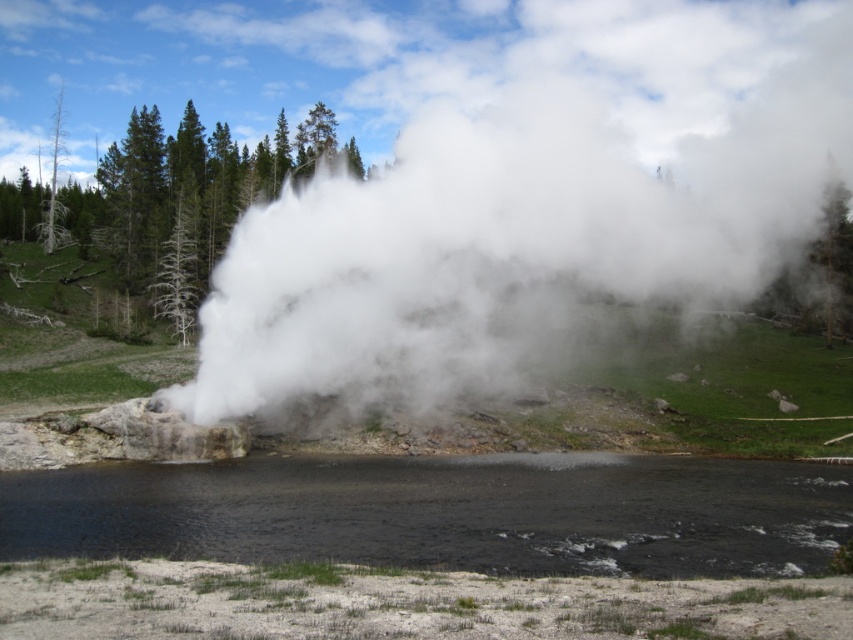
You are a hiker standing at the edge of the river and want to cross it. You notice the white vapor at center and the black liquid at center. Which object is closer to you, the hiker?

The white vapor at center is closer to you than the black liquid at center because it is further to the viewer.